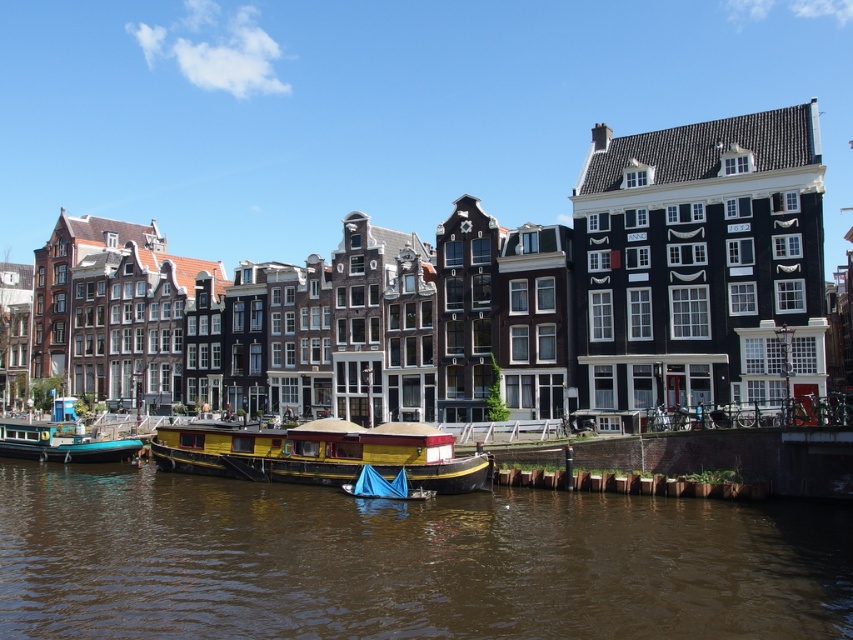
You are a tourist standing on the dock and want to take a photo of the teal glossy houseboat at lower left and the brown water at lower center. If you need both objects to be in focus, which one should you focus on first to ensure the other is also in focus?

You should focus on the teal glossy houseboat at lower left first because it is closer to you than the brown water at lower center. By focusing on the closer object, the farther object will also be in focus due to the depth of field.

You are standing at the edge of the canal and want to know where the brown water at lower center is positioned relative to your viewpoint. Can you determine its location based on the coordinates provided?

The brown water at lower center is located at point (405, 561), which means it is positioned towards the lower right side of the scene from your viewpoint.